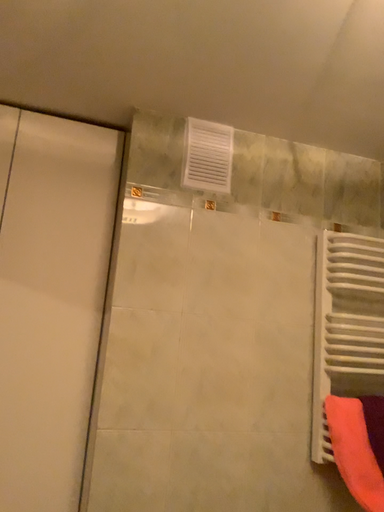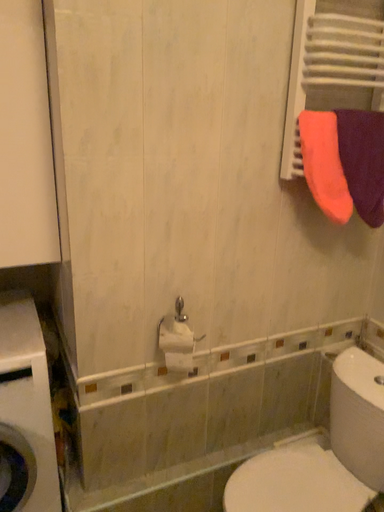
Question: Which way did the camera rotate in the video?

Choices:
 (A) rotated downward
 (B) rotated upward

Answer: (A)